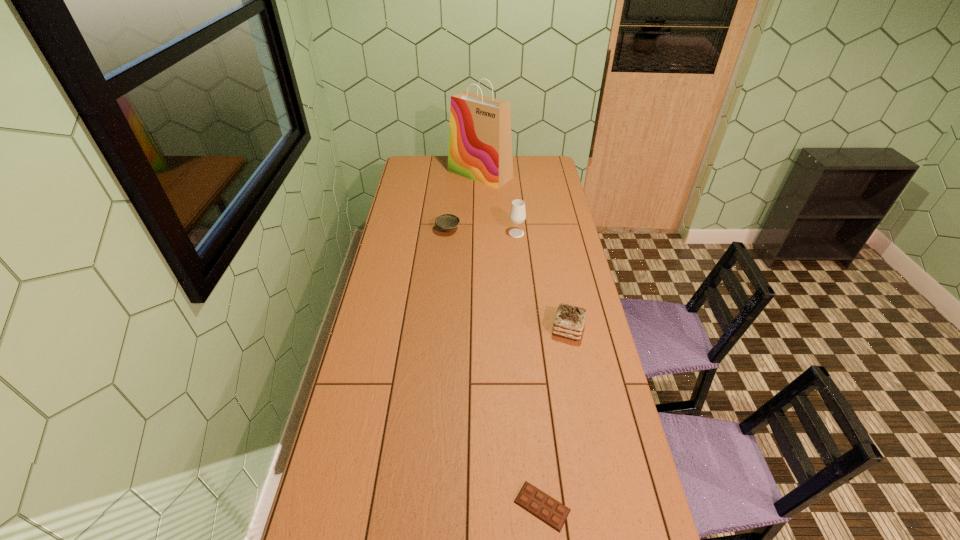
You are a GUI agent. You are given a task and a screenshot of the screen. Output one action in this format:
    pyautogui.click(x=<x>, y=<y>)
    Task: Click on the empty location between the bowl and the fourth shortest object
    
    Given the screenshot: What is the action you would take?
    pyautogui.click(x=482, y=232)

I want to click on free area in between the glass and the chocolate bar, so click(529, 369).

This screenshot has width=960, height=540. In order to click on vacant space in between the tallest object and the bowl in this screenshot , I will do `click(464, 202)`.

Identify the location of unoccupied area between the second tallest object and the farthest object. Image resolution: width=960 pixels, height=540 pixels. (498, 204).

Locate an element on the screen. The width and height of the screenshot is (960, 540). free spot between the second tallest object and the fourth tallest object is located at coordinates (482, 232).

Where is `unoccupied position between the chocolate bar and the bowl`? unoccupied position between the chocolate bar and the bowl is located at coordinates (495, 368).

Where is `blank region between the nearest object and the rightmost object`? Image resolution: width=960 pixels, height=540 pixels. blank region between the nearest object and the rightmost object is located at coordinates (555, 417).

Where is `vacant space that's between the nearest object and the rightmost object`? This screenshot has width=960, height=540. vacant space that's between the nearest object and the rightmost object is located at coordinates (555, 417).

Find the location of a particular element. empty space that is in between the farthest object and the chocolate bar is located at coordinates (511, 340).

The image size is (960, 540). Identify the location of object that is the third closest one to the shortest object. (447, 222).